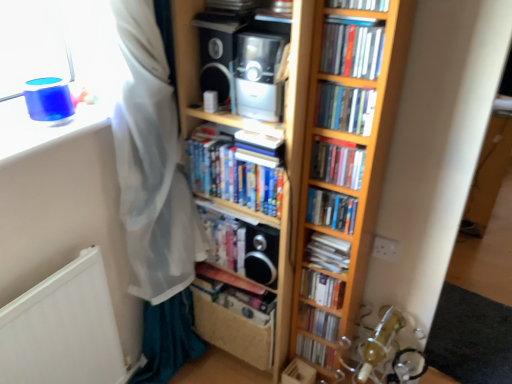
Describe the element at coordinates (322, 288) in the screenshot. The image size is (512, 384). I see `hardcover book at center, acting as the 9th book starting from the top` at that location.

Identify the location of satin black speaker at center, which appears as the 1th speaker when ordered from the bottom. (261, 254).

Measure the distance between satin black speaker at center, which is counted as the 2th speaker, starting from the top, and camera.

The distance of satin black speaker at center, which is counted as the 2th speaker, starting from the top, from camera is 4.57 feet.

Where is `hardcover book at center, positioned as the fourth book in bottom-to-top order`? The height and width of the screenshot is (384, 512). hardcover book at center, positioned as the fourth book in bottom-to-top order is located at coordinates (322, 288).

How distant is white paper book at center, which is counted as the 5th book, starting from the bottom, from hardcover book at center, acting as the 3th book starting from the top?

17.22 inches.

Which point is more forward, (x=307, y=252) or (x=318, y=115)?

Positioned in front is point (x=318, y=115).

Is white paper book at center, which is counted as the 5th book, starting from the bottom, at the left side of hardcover book at center, acting as the tenth book starting from the bottom?

Indeed, white paper book at center, which is counted as the 5th book, starting from the bottom, is positioned on the left side of hardcover book at center, acting as the tenth book starting from the bottom.

In the scene shown: Is white paper book at center, which is counted as the 5th book, starting from the bottom, inside or outside of hardcover book at center, acting as the tenth book starting from the bottom?

white paper book at center, which is counted as the 5th book, starting from the bottom, exists outside the volume of hardcover book at center, acting as the tenth book starting from the bottom.

Does matte black speaker at upper center, the 2th speaker from the right, have a greater width compared to hardcover book at center, placed as the twelfth book when sorted from top to bottom?

Indeed, matte black speaker at upper center, the 2th speaker from the right, has a greater width compared to hardcover book at center, placed as the twelfth book when sorted from top to bottom.

Between matte black speaker at upper center, the 2th speaker ordered from the bottom, and hardcover book at center, which is counted as the 1th book, starting from the bottom, which one is positioned in front?

matte black speaker at upper center, the 2th speaker ordered from the bottom.

I want to click on the 8th book behind the matte black speaker at upper center, the 1th speaker when ordered from top to bottom, so click(316, 352).

Does satin black speaker at center, which is counted as the 2th speaker, starting from the top, have a smaller size compared to matte black speaker at upper center, the 1th speaker when ordered from top to bottom?

Correct, satin black speaker at center, which is counted as the 2th speaker, starting from the top, occupies less space than matte black speaker at upper center, the 1th speaker when ordered from top to bottom.

Does satin black speaker at center, which is the second speaker from left to right, have a lesser height compared to matte black speaker at upper center, the 2th speaker ordered from the bottom?

No, satin black speaker at center, which is the second speaker from left to right, is not shorter than matte black speaker at upper center, the 2th speaker ordered from the bottom.

Is satin black speaker at center, which is the second speaker from left to right, far from matte black speaker at upper center, the 2th speaker from the right?

That's not correct — satin black speaker at center, which is the second speaker from left to right, is a little close to matte black speaker at upper center, the 2th speaker from the right.

What's the angular difference between hardcover book at center, acting as the tenth book starting from the bottom, and matte black speaker at upper center, the 2th speaker ordered from the bottom,'s facing directions?

hardcover book at center, acting as the tenth book starting from the bottom, and matte black speaker at upper center, the 2th speaker ordered from the bottom, are facing 2.48 degrees away from each other.

Can you confirm if hardcover book at center, acting as the 3th book starting from the top, is wider than matte black speaker at upper center, the 2th speaker ordered from the bottom?

No, hardcover book at center, acting as the 3th book starting from the top, is not wider than matte black speaker at upper center, the 2th speaker ordered from the bottom.

Is hardcover book at center, acting as the tenth book starting from the bottom, taller or shorter than matte black speaker at upper center, the 2th speaker from the right?

Clearly, hardcover book at center, acting as the tenth book starting from the bottom, is shorter compared to matte black speaker at upper center, the 2th speaker from the right.

This screenshot has width=512, height=384. I want to click on the 2nd book below the matte black speaker at upper center, the 2th speaker ordered from the bottom (from the image's perspective), so pyautogui.click(x=345, y=108).

Which is more to the right, satin black speaker at center, which appears as the 1th speaker when ordered from the bottom, or hardcover book at center, which is counted as the 1th book, starting from the bottom?

Positioned to the right is hardcover book at center, which is counted as the 1th book, starting from the bottom.

Considering the relative sizes of satin black speaker at center, which appears as the 1th speaker when ordered from the bottom, and hardcover book at center, which is counted as the 1th book, starting from the bottom, in the image provided, is satin black speaker at center, which appears as the 1th speaker when ordered from the bottom, bigger than hardcover book at center, which is counted as the 1th book, starting from the bottom,?

Yes.

Is satin black speaker at center, which is counted as the 2th speaker, starting from the top, far from hardcover book at center, placed as the twelfth book when sorted from top to bottom?

No, satin black speaker at center, which is counted as the 2th speaker, starting from the top, is not far from hardcover book at center, placed as the twelfth book when sorted from top to bottom.

Who is shorter, satin black speaker at center, which is the second speaker from left to right, or hardcover book at center, which is counted as the 1th book, starting from the bottom?

hardcover book at center, which is counted as the 1th book, starting from the bottom.

From the image's perspective, which object appears higher, hardcover book at center, acting as the 9th book starting from the top, or white paper book at center, arranged as the 8th book when viewed from the top?

white paper book at center, arranged as the 8th book when viewed from the top, from the image's perspective.

Can you confirm if hardcover book at center, positioned as the fourth book in bottom-to-top order, is thinner than white paper book at center, which is counted as the 5th book, starting from the bottom?

Yes, hardcover book at center, positioned as the fourth book in bottom-to-top order, is thinner than white paper book at center, which is counted as the 5th book, starting from the bottom.

Is hardcover book at center, positioned as the fourth book in bottom-to-top order, positioned behind white paper book at center, which is counted as the 5th book, starting from the bottom?

Yes, hardcover book at center, positioned as the fourth book in bottom-to-top order, is further from the viewer.

Between hardcover book at center, acting as the 9th book starting from the top, and white paper book at center, which is counted as the 5th book, starting from the bottom, which one appears on the left side from the viewer's perspective?

Positioned to the left is hardcover book at center, acting as the 9th book starting from the top.

From the image's perspective, is hardcover book at center, arranged as the 10th book when viewed from the top, above hardcover book at center, which is the 11th book in top-to-bottom order?

Yes, from the image's perspective, hardcover book at center, arranged as the 10th book when viewed from the top, is over hardcover book at center, which is the 11th book in top-to-bottom order.

Considering the relative sizes of hardcover book at center, which appears as the 3th book when ordered from the bottom, and hardcover book at center, which is the 11th book in top-to-bottom order, in the image provided, is hardcover book at center, which appears as the 3th book when ordered from the bottom, shorter than hardcover book at center, which is the 11th book in top-to-bottom order,?

Yes.

Considering the points (220, 270) and (321, 311), which point is in front, point (220, 270) or point (321, 311)?

The point (321, 311) is closer.

Considering the relative positions of hardcover book at center, which appears as the 3th book when ordered from the bottom, and hardcover book at center, the second book positioned from the bottom, in the image provided, is hardcover book at center, which appears as the 3th book when ordered from the bottom, to the left of hardcover book at center, the second book positioned from the bottom, from the viewer's perspective?

Correct, you'll find hardcover book at center, which appears as the 3th book when ordered from the bottom, to the left of hardcover book at center, the second book positioned from the bottom.

From the white paper book at center, arranged as the 8th book when viewed from the top, count 1st book to the right and point to it. Please provide its 2D coordinates.

[(345, 108)]

At what (x,y) coordinates should I click in order to perform the action: click on speaker that is the 2nd object above the hardcover book at center, placed as the twelfth book when sorted from top to bottom (from a real-world perspective). Please return your answer as a coordinate pair (x, y). The height and width of the screenshot is (384, 512). Looking at the image, I should click on (216, 52).

Looking at the image, which one is located closer to hardcover book at center, marked as the 7th book in a top-to-bottom arrangement, hardcover book at upper center, marked as the 12th book in a bottom-to-top arrangement, or hardcover book at center, which is counted as the 7th book, starting from the bottom?

Among the two, hardcover book at center, which is counted as the 7th book, starting from the bottom, is located nearer to hardcover book at center, marked as the 7th book in a top-to-bottom arrangement.

Considering their positions, is hardcover book at center, marked as the 7th book in a top-to-bottom arrangement, positioned closer to matte black speaker at upper center, the 1th speaker when ordered from top to bottom, than wooden bookcase at center?

wooden bookcase at center lies closer to matte black speaker at upper center, the 1th speaker when ordered from top to bottom, than the other object.

From the image, which object appears to be farther from satin black speaker at center, which is counted as the 2th speaker, starting from the top, hardcover books at center, arranged as the 5th book when viewed from the top, or hardcover book at center, placed as the fourth book when sorted from top to bottom?

hardcover book at center, placed as the fourth book when sorted from top to bottom, is further to satin black speaker at center, which is counted as the 2th speaker, starting from the top.

Estimate the real-world distances between objects in this image. Which object is closer to matte black speaker at upper center, the 1th speaker when ordered from top to bottom, hardcover book at center, placed as the twelfth book when sorted from top to bottom, or hardcover book at center, arranged as the ninth book when ordered from the bottom?

hardcover book at center, arranged as the ninth book when ordered from the bottom, is closer to matte black speaker at upper center, the 1th speaker when ordered from top to bottom.

Based on their spatial positions, is hardcover book at center, which appears as the 3th book when ordered from the bottom, or hardcover book at upper center, marked as the 12th book in a bottom-to-top arrangement, further from hardcover books at center, arranged as the 5th book when viewed from the top?

hardcover book at upper center, marked as the 12th book in a bottom-to-top arrangement.

When comparing their distances from hardcover book at center, arranged as the 10th book when viewed from the top, does hardcover book at center, which is the 11th book in top-to-bottom order, or hardcover book at center, positioned as the fourth book in bottom-to-top order, seem closer?

Based on the image, hardcover book at center, which is the 11th book in top-to-bottom order, appears to be nearer to hardcover book at center, arranged as the 10th book when viewed from the top.

Estimate the real-world distances between objects in this image. Which object is further from wooden bookcase at center, hardcover book at center, which is counted as the 7th book, starting from the bottom, or hardcover book at upper center, marked as the 12th book in a bottom-to-top arrangement?

Among the two, hardcover book at upper center, marked as the 12th book in a bottom-to-top arrangement, is located further to wooden bookcase at center.

When comparing their distances from hardcover book at center, positioned as the fourth book in bottom-to-top order, does hardcover book at center, acting as the 3th book starting from the top, or hardcover book at center, the second book positioned from the bottom, seem closer?

hardcover book at center, the second book positioned from the bottom, is positioned closer to the anchor hardcover book at center, positioned as the fourth book in bottom-to-top order.

Locate an element on the screen. speaker between hardcover book at center, acting as the 3th book starting from the top, and hardcover book at center, which is the 11th book in top-to-bottom order, in the up-down direction is located at coordinates (261, 254).

Where is `bookcase between white matte radiator at lower left and hardcover book at center, which is counted as the 1th book, starting from the bottom, from left to right`? bookcase between white matte radiator at lower left and hardcover book at center, which is counted as the 1th book, starting from the bottom, from left to right is located at coordinates (341, 140).

At what (x,y) coordinates should I click in order to perform the action: click on speaker between hardcover book at upper center, which ranks as the 1th book in top-to-bottom order, and hardcover book at center, placed as the fourth book when sorted from top to bottom, vertically. Please return your answer as a coordinate pair (x, y). The height and width of the screenshot is (384, 512). Looking at the image, I should click on (216, 52).

At what (x,y) coordinates should I click in order to perform the action: click on bookcase between hardcover book at upper center, marked as the 12th book in a bottom-to-top arrangement, and hardcover book at center, which is counted as the 1th book, starting from the bottom, in the up-down direction. Please return your answer as a coordinate pair (x, y). Looking at the image, I should click on (341, 140).